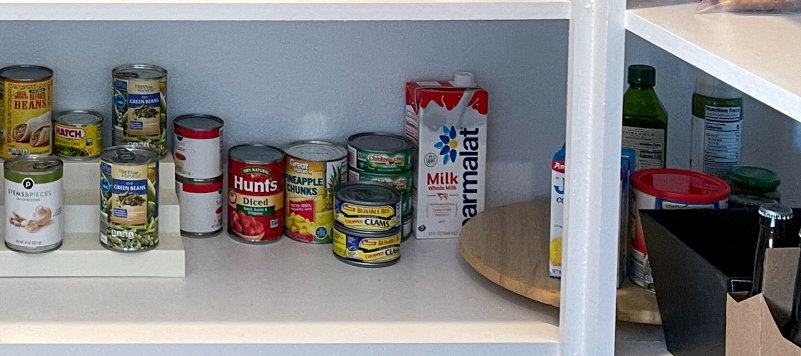
Where is `staircase shelfing`? This screenshot has height=356, width=801. staircase shelfing is located at coordinates (78, 239), (77, 198), (67, 163).